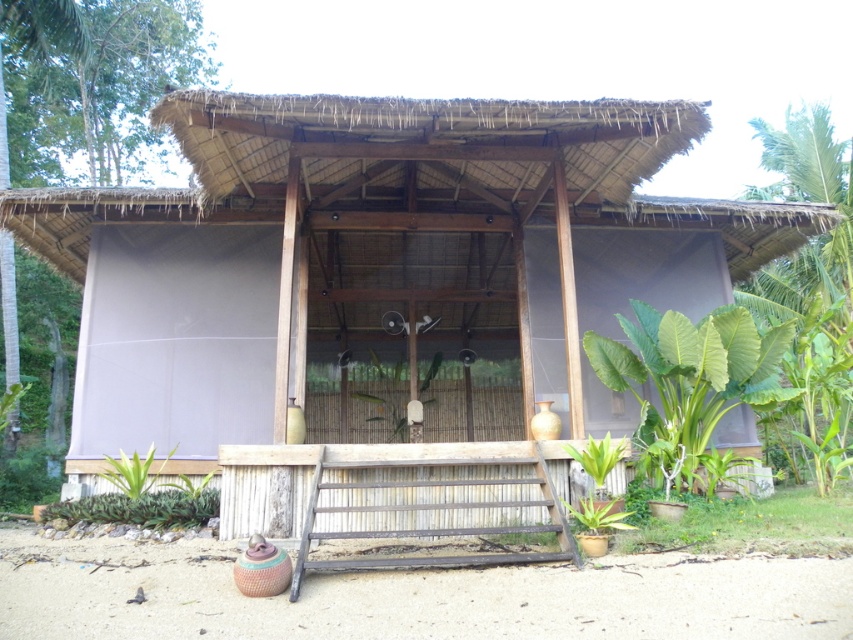
You are a visitor approaching the wooden hut at center and notice the green leafy plant at right nearby. Which object would you see first as you walk towards them from a distance?

The wooden hut at center would be seen first because it is much taller than the green leafy plant at right, making it more visible from a distance.

You are standing in front of the traditional structure and want to determine which of the two points, point (x=749, y=228) or point (x=138, y=468), is closer to you. Which point is nearer?

Point (x=749, y=228) is closer to you because it is further to the viewer than point (x=138, y=468).

You are standing at the entrance of the traditional structure and want to place a new potted plant exactly at the same position as the green leafy plant at right. What are the coordinates where you should place it?

The green leafy plant at right is located at coordinates point (692, 372), so you should place the new potted plant at those coordinates.